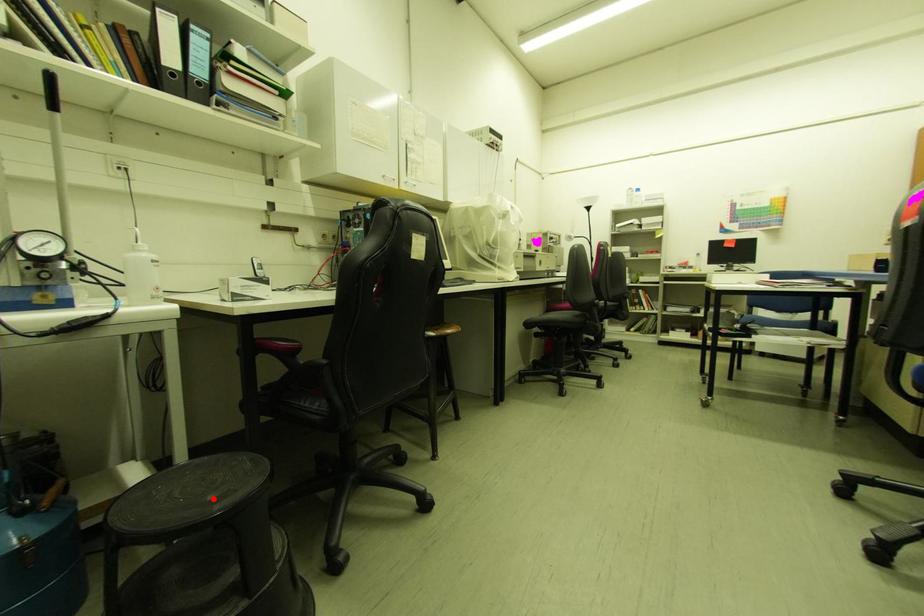
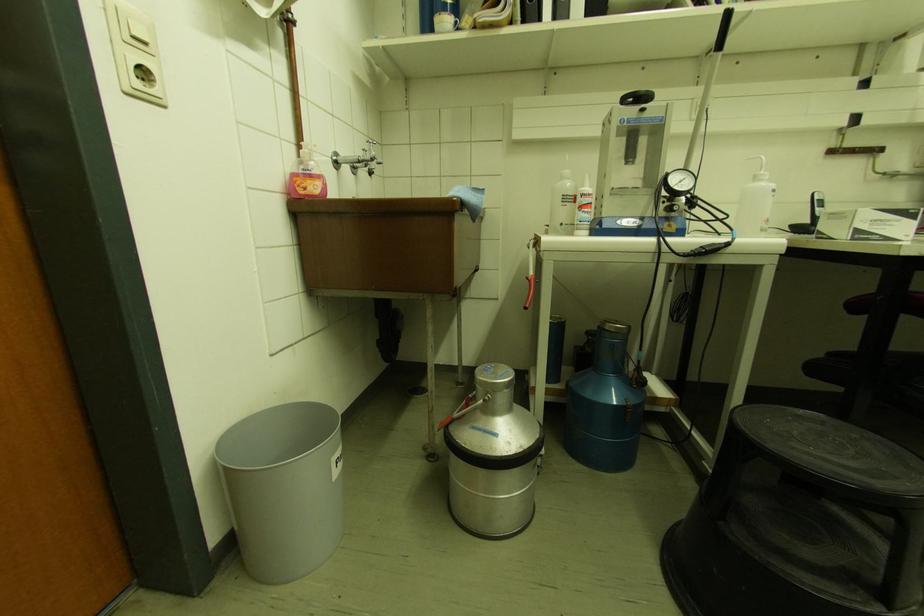
Question: I am providing you with two images of the same scene from different viewpoints. A red point is shown in image1. For the corresponding object point in image2, is it positioned nearer or farther from the camera?

Choices:
 (A) Nearer
 (B) Farther

Answer: (A)